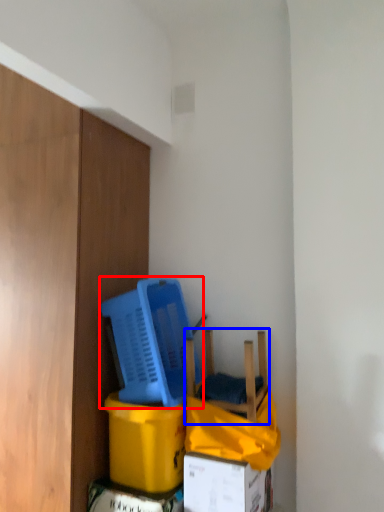
Question: Which object appears farthest to the camera in this image, basket (highlighted by a red box) or chair (highlighted by a blue box)?

Choices:
 (A) basket
 (B) chair

Answer: (A)